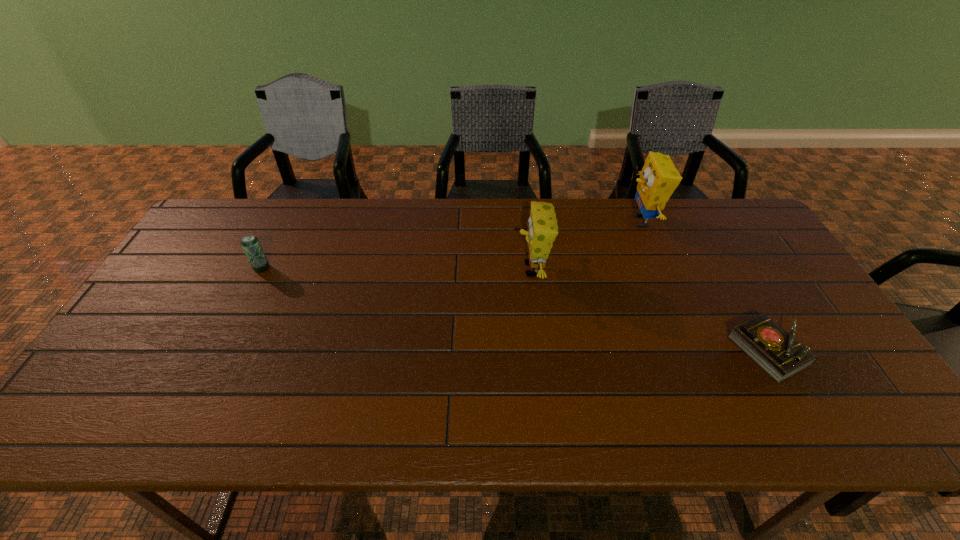
Where is `the second object from right to left`? the second object from right to left is located at coordinates (659, 178).

Identify the location of the left sponge. (543, 229).

Identify the location of the leftmost object. The height and width of the screenshot is (540, 960). (250, 243).

Locate an element on the screen. the third tallest object is located at coordinates (250, 243).

At what (x,y) coordinates should I click in order to perform the action: click on the rightmost object. Please return your answer as a coordinate pair (x, y). Looking at the image, I should click on (777, 352).

Locate an element on the screen. the shortest object is located at coordinates (777, 352).

Find the location of a particular element. This screenshot has height=540, width=960. free point located 0.050m on the face of the third object from left to right is located at coordinates (610, 221).

The width and height of the screenshot is (960, 540). What are the coordinates of `free space located on the face of the third object from left to right` in the screenshot? It's located at (508, 221).

You are a GUI agent. You are given a task and a screenshot of the screen. Output one action in this format:
    pyautogui.click(x=<x>, y=<y>)
    Task: Click on the free space located 0.170m on the face of the third object from left to right
    
    Given the screenshot: What is the action you would take?
    pyautogui.click(x=574, y=221)

The width and height of the screenshot is (960, 540). What are the coordinates of `vacant space located on the face of the left sponge` in the screenshot? It's located at (492, 269).